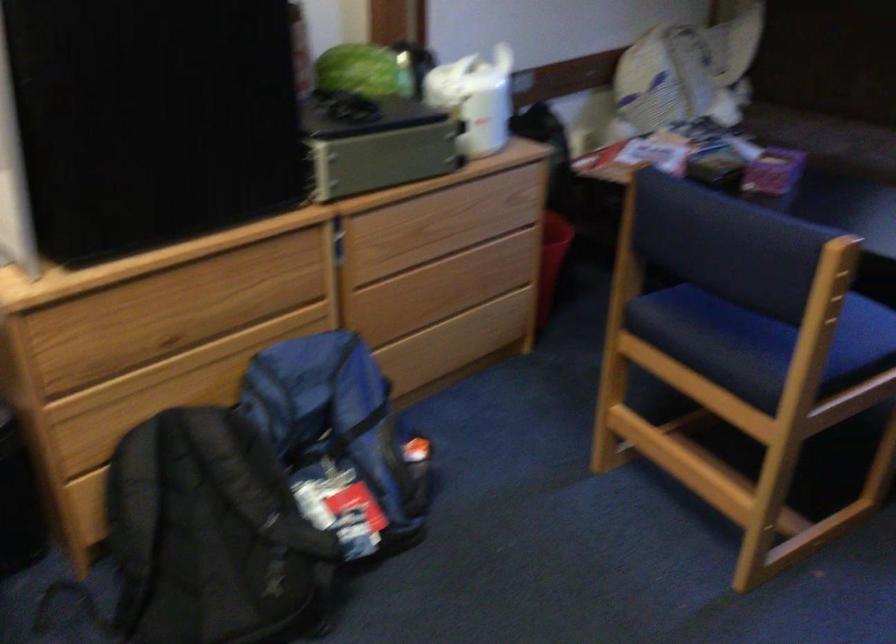
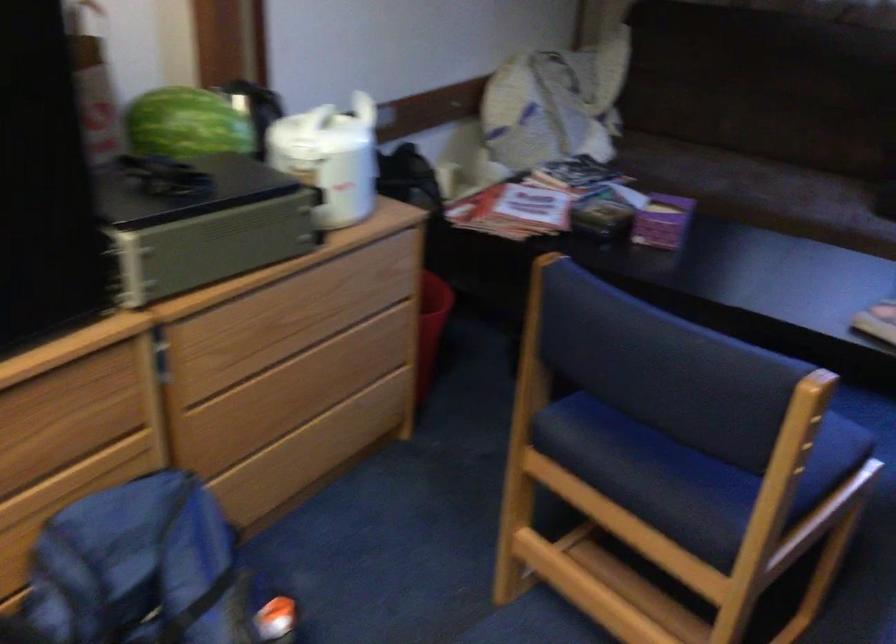
Question: The camera is either moving clockwise (left) or counter-clockwise (right) around the object. The first image is from the beginning of the video and the second image is from the end. Is the camera moving left or right when shooting the video?

Choices:
 (A) Left
 (B) Right

Answer: (A)